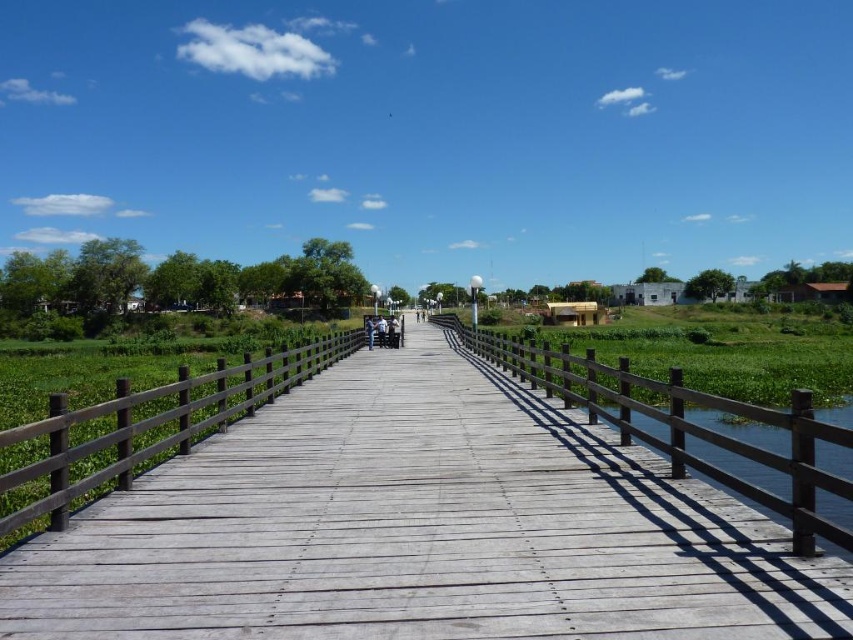
Question: Is the position of weathered wood bridge at center more distant than that of clear water at right?

Choices:
 (A) yes
 (B) no

Answer: (B)

Question: Is weathered wood bridge at center to the right of clear water at right from the viewer's perspective?

Choices:
 (A) no
 (B) yes

Answer: (A)

Question: Which object appears closest to the camera in this image?

Choices:
 (A) weathered wood bridge at center
 (B) clear water at right

Answer: (A)

Question: Which point is closer to the camera?

Choices:
 (A) weathered wood bridge at center
 (B) clear water at right

Answer: (A)

Question: Can you confirm if weathered wood bridge at center is bigger than clear water at right?

Choices:
 (A) no
 (B) yes

Answer: (A)